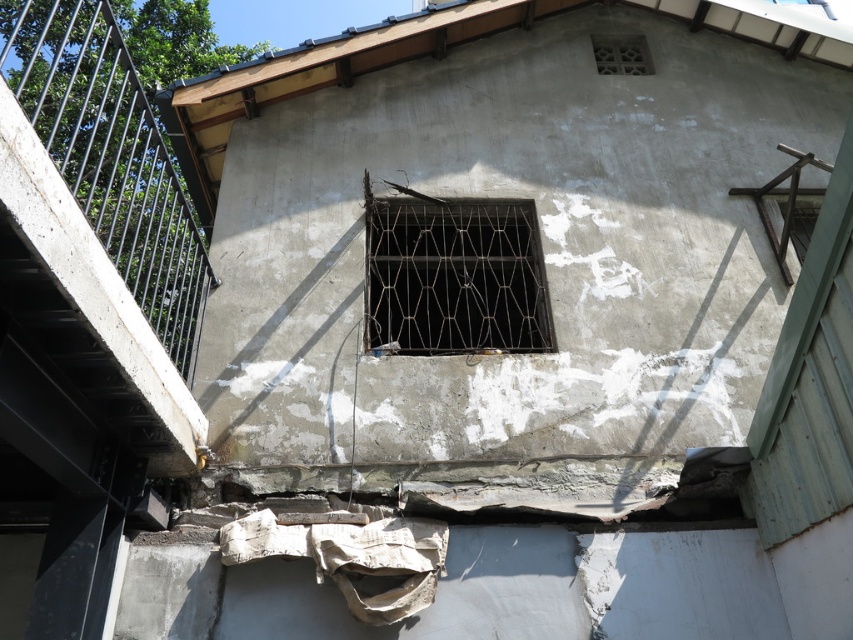
Question: Estimate the real-world distances between objects in this image. Which object is closer to the white textured vent at upper center?

Choices:
 (A) black metal railing at upper left
 (B) black metal grid at center

Answer: (B)

Question: Which object is closer to the camera taking this photo?

Choices:
 (A) white textured vent at upper center
 (B) black metal grid at center

Answer: (B)

Question: Is black metal grid at center wider than white textured vent at upper center?

Choices:
 (A) yes
 (B) no

Answer: (A)

Question: Can you confirm if black metal railing at upper left is positioned to the left of black metal grid at center?

Choices:
 (A) yes
 (B) no

Answer: (A)

Question: Is black metal grid at center wider than white textured vent at upper center?

Choices:
 (A) no
 (B) yes

Answer: (B)

Question: Which object is positioned closest to the black metal grid at center?

Choices:
 (A) black metal railing at upper left
 (B) white textured vent at upper center

Answer: (B)